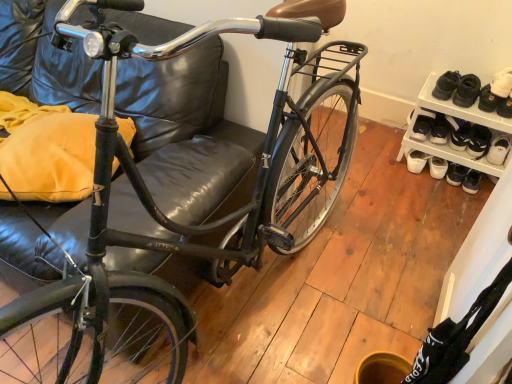
Question: From a real-world perspective, is white suede shoe at upper right physically located above or below shiny black bicycle at center?

Choices:
 (A) below
 (B) above

Answer: (A)

Question: From the image's perspective, is white suede shoe at upper right positioned above or below shiny black bicycle at center?

Choices:
 (A) below
 (B) above

Answer: (B)

Question: Considering the real-world distances, which object is farthest from the white matte shoe at right, arranged as the first footwear when viewed from the left?

Choices:
 (A) shiny black bicycle at center
 (B) white mesh shoe rack at lower right
 (C) white suede shoe at upper right
 (D) white leather shoe at upper right, which is the second footwear in left-to-right order

Answer: (A)

Question: Which of these objects is positioned farthest from the shiny black bicycle at center?

Choices:
 (A) white leather shoe at upper right, the first footwear from the right
 (B) white mesh shoe rack at lower right
 (C) white matte shoe at right, arranged as the first footwear when viewed from the left
 (D) white suede shoe at upper right

Answer: (A)